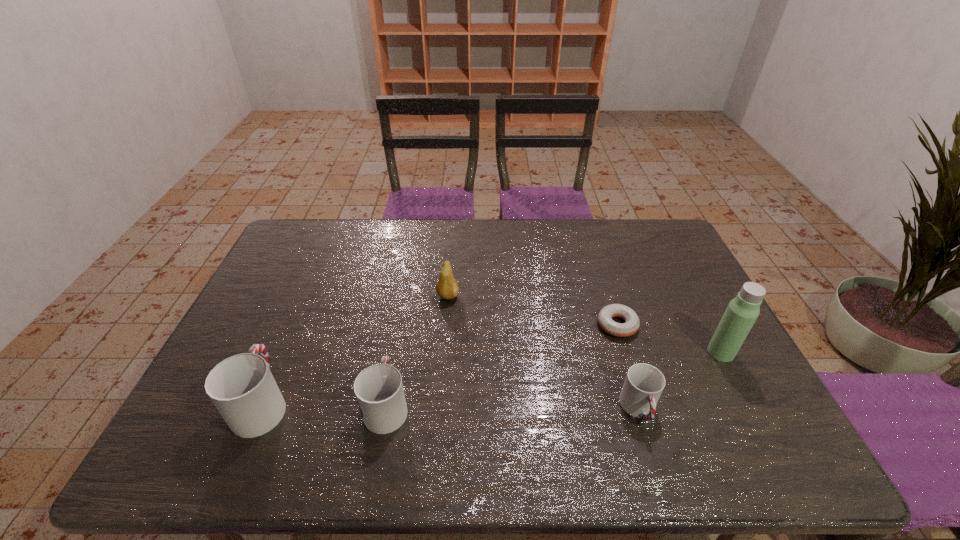
Select which object appears as the third closest to the fifth object from right to left. Please provide its 2D coordinates. Your answer should be formatted as a tuple, i.e. [(x, y)], where the tuple contains the x and y coordinates of a point satisfying the conditions above.

[(644, 383)]

Select which cup appears as the closest to the pear. Please provide its 2D coordinates. Your answer should be formatted as a tuple, i.e. [(x, y)], where the tuple contains the x and y coordinates of a point satisfying the conditions above.

[(379, 391)]

Identify which cup is located as the nearest to the fifth nearest object. Please provide its 2D coordinates. Your answer should be formatted as a tuple, i.e. [(x, y)], where the tuple contains the x and y coordinates of a point satisfying the conditions above.

[(644, 383)]

Identify the location of free space that satisfies the following two spatial constraints: 1. on the front side of the tallest object; 2. on the left side of the doughnut. (626, 352).

The width and height of the screenshot is (960, 540). What are the coordinates of `free region that satisfies the following two spatial constraints: 1. on the side of the tallest object where the handle is located; 2. on the left side of the tallest cup` in the screenshot? It's located at (284, 352).

Locate an element on the screen. The width and height of the screenshot is (960, 540). vacant position in the image that satisfies the following two spatial constraints: 1. on the side of the farthest object where the handle is located; 2. on the left side of the leftmost object is located at coordinates (308, 296).

Find the location of a particular element. vacant space that satisfies the following two spatial constraints: 1. on the side of the farthest object where the handle is located; 2. on the left side of the leftmost object is located at coordinates (308, 296).